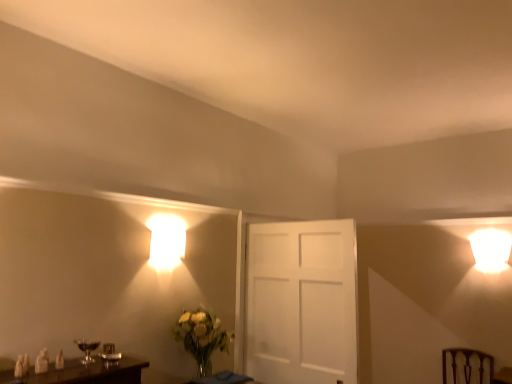
Question: Considering the positions of brown wooden swivel chair at lower right and translucent glass table at lower center in the image, is brown wooden swivel chair at lower right taller or shorter than translucent glass table at lower center?

Choices:
 (A) short
 (B) tall

Answer: (B)

Question: From a real-world perspective, is brown wooden swivel chair at lower right positioned above or below translucent glass table at lower center?

Choices:
 (A) below
 (B) above

Answer: (A)

Question: Which object is positioned farthest from the translucent glass table at lower center?

Choices:
 (A) matte glass wine glass at lower left
 (B) brown wooden swivel chair at lower right
 (C) translucent glass vase at lower left

Answer: (B)

Question: Based on their relative distances, which object is farther from the translucent glass vase at lower left?

Choices:
 (A) matte glass wine glass at lower left
 (B) translucent glass table at lower center
 (C) brown wooden swivel chair at lower right

Answer: (C)